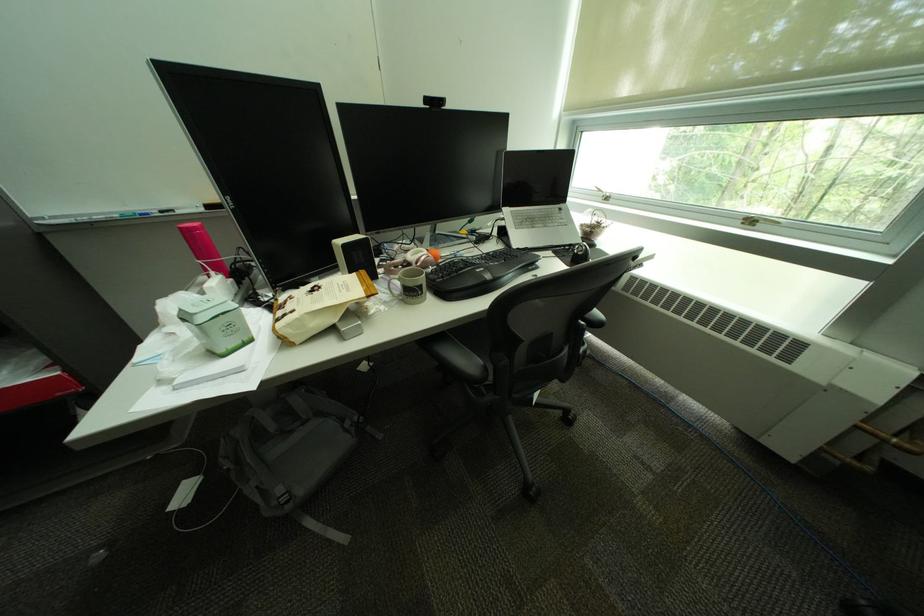
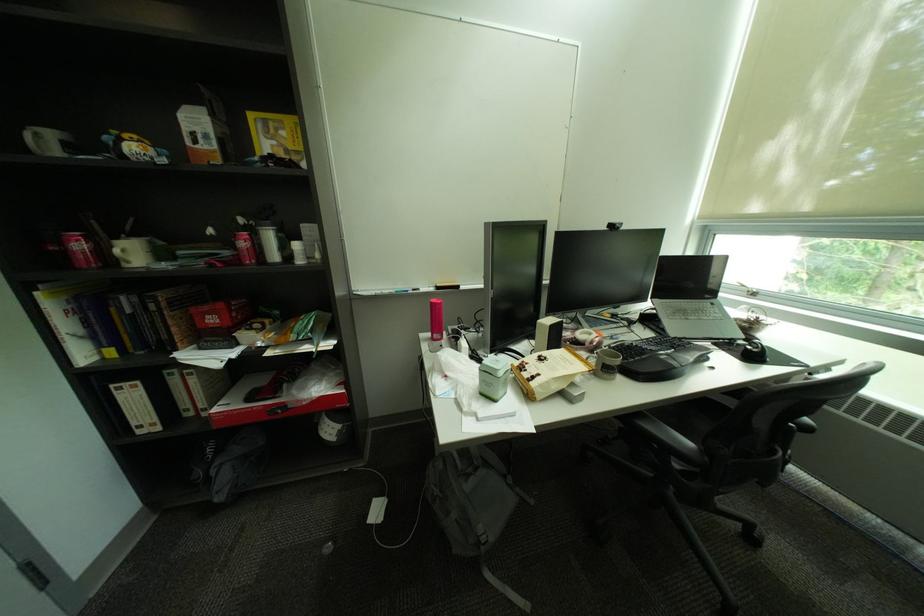
Find the pixel in the second image that matches [438,100] in the first image.

(621, 227)